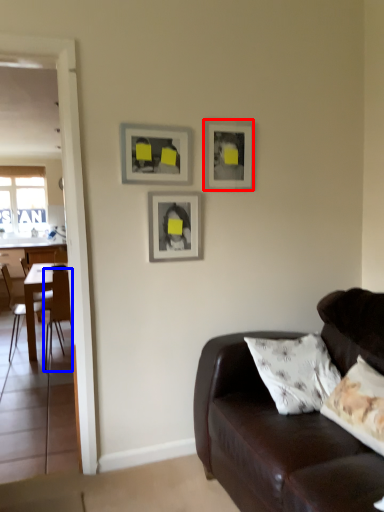
Question: Which of the following is the closest to the observer, picture frame (highlighted by a red box) or chair (highlighted by a blue box)?

Choices:
 (A) picture frame
 (B) chair

Answer: (A)